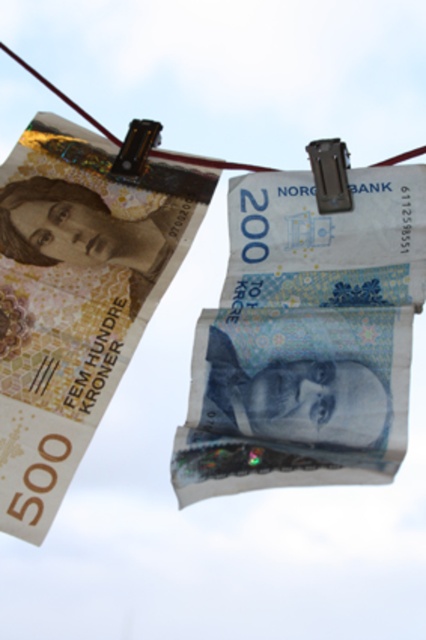
Which is more to the left, blue paper currency at center or matte paper banknote at upper left?

matte paper banknote at upper left

Between blue paper currency at center and matte paper banknote at upper left, which one is positioned lower?

blue paper currency at center is lower down.

Where is `blue paper currency at center`? This screenshot has height=640, width=426. blue paper currency at center is located at coordinates (307, 337).